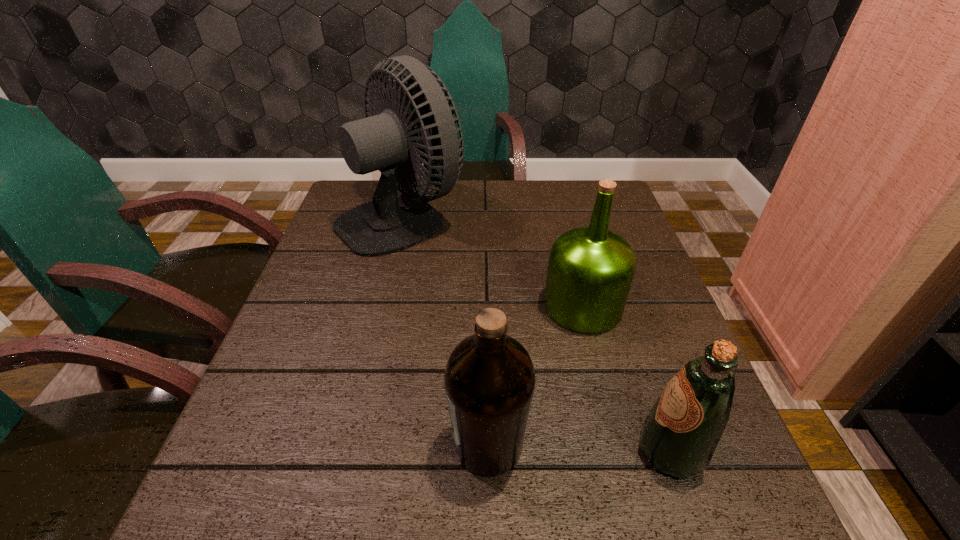
This screenshot has width=960, height=540. In the image, there is a desktop. Identify the location of free space at the right edge. (658, 300).

This screenshot has height=540, width=960. In order to click on vacant area at the near right corner of the desktop in this screenshot , I will do `click(678, 513)`.

This screenshot has height=540, width=960. I want to click on empty location between the shortest olive oil and the third nearest object, so click(627, 378).

You are a GUI agent. You are given a task and a screenshot of the screen. Output one action in this format:
    pyautogui.click(x=<x>, y=<y>)
    Task: Click on the empty space that is in between the leftmost olive oil and the shortest olive oil
    
    Given the screenshot: What is the action you would take?
    pyautogui.click(x=579, y=448)

Where is `free spot between the shortest olive oil and the leftmost olive oil`? Image resolution: width=960 pixels, height=540 pixels. free spot between the shortest olive oil and the leftmost olive oil is located at coordinates (579, 448).

Locate an element on the screen. free space between the shortest object and the second farthest object is located at coordinates (627, 378).

Find the location of a particular element. This screenshot has height=540, width=960. free space between the leftmost olive oil and the tallest object is located at coordinates (445, 331).

Find the location of a particular element. This screenshot has width=960, height=540. free point between the shortest object and the leftmost olive oil is located at coordinates (579, 448).

The height and width of the screenshot is (540, 960). I want to click on vacant space that's between the tallest object and the farthest olive oil, so click(492, 261).

Find the location of a particular element. free space that is in between the leftmost olive oil and the shortest olive oil is located at coordinates (579, 448).